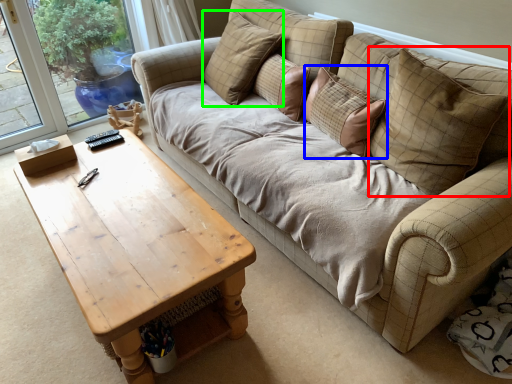
Question: Based on their relative distances, which object is farther from pillow (highlighted by a red box)? Choose from pillow (highlighted by a blue box) and pillow (highlighted by a green box).

Choices:
 (A) pillow
 (B) pillow

Answer: (B)